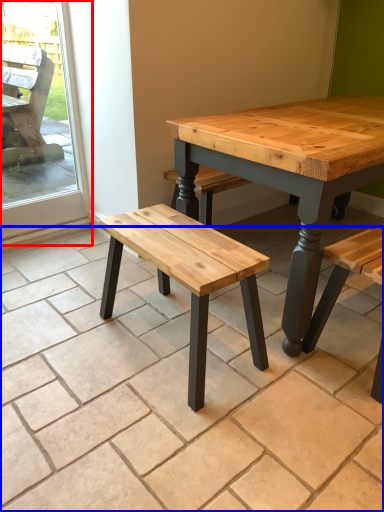
Question: Among these objects, which one is farthest to the camera, screen door (highlighted by a red box) or tile (highlighted by a blue box)?

Choices:
 (A) screen door
 (B) tile

Answer: (A)